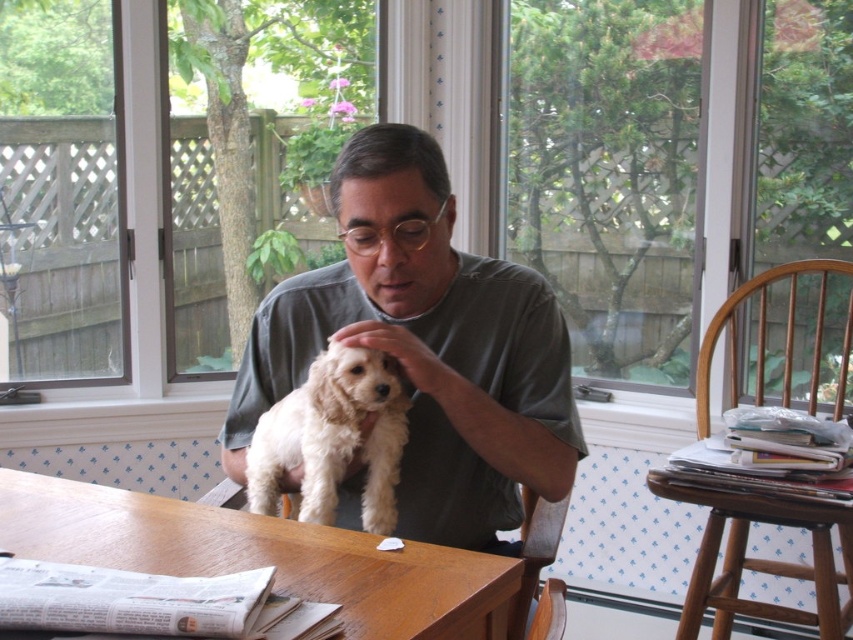
Question: Which of the following is the farthest from the observer?

Choices:
 (A) (166, 545)
 (B) (654, 474)
 (C) (254, 465)
 (D) (405, 348)

Answer: (B)

Question: Which point is closer to the camera?

Choices:
 (A) (372, 616)
 (B) (347, 224)
 (C) (291, 404)

Answer: (A)

Question: Does wooden table at center appear under wooden stool at lower right?

Choices:
 (A) no
 (B) yes

Answer: (A)

Question: Which of the following is the closest to the observer?

Choices:
 (A) (293, 424)
 (B) (474, 627)
 (C) (543, 410)

Answer: (B)

Question: Can you confirm if gray cotton shirt at center is positioned above wooden stool at lower right?

Choices:
 (A) yes
 (B) no

Answer: (A)

Question: Can you confirm if gray cotton shirt at center is positioned to the right of wooden stool at lower right?

Choices:
 (A) no
 (B) yes

Answer: (A)